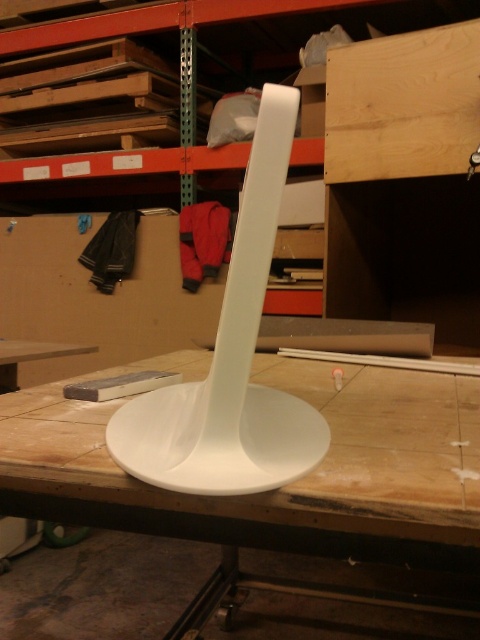
You are positioning a new item in the workspace. The white matte table at center is at coordinates 0.762, 0.588. Can you place an item at coordinate 0.7, 0.6 without overlapping?

The white matte table at center is located at point [282,486]. Since the new coordinates [288,448] are close but not exactly the same, it might overlap depending on the item size. Check the exact dimensions before placing.

Consider the image. You are organizing the workspace and need to move the white matte table at center closer to the light brown wood at upper right. Considering their current positions, which object will be closer to you after moving the table?

After moving the white matte table at center closer to the light brown wood at upper right, the white matte table at center will be closer to you since it was originally in front of the light brown wood at upper right.